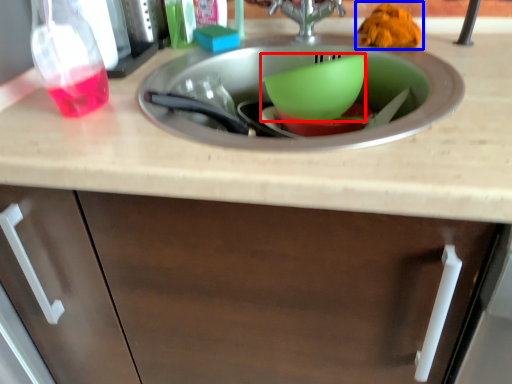
Question: Which of the following is the closest to the observer, basin (highlighted by a red box) or food (highlighted by a blue box)?

Choices:
 (A) basin
 (B) food

Answer: (A)